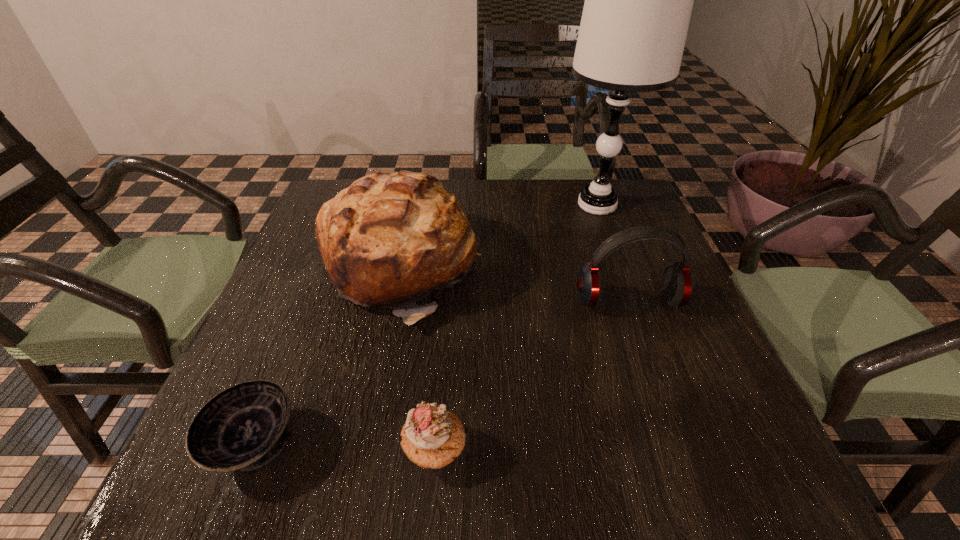
Image resolution: width=960 pixels, height=540 pixels. Find the location of `free space that is in between the bread and the tallest object`. free space that is in between the bread and the tallest object is located at coordinates (498, 236).

What are the coordinates of `vacant point located between the shortest object and the earphone` in the screenshot? It's located at (442, 372).

You are a GUI agent. You are given a task and a screenshot of the screen. Output one action in this format:
    pyautogui.click(x=<x>, y=<y>)
    Task: Click on the free space between the bread and the third tallest object
    
    Given the screenshot: What is the action you would take?
    pyautogui.click(x=514, y=284)

The height and width of the screenshot is (540, 960). I want to click on unoccupied area between the bread and the earphone, so click(514, 284).

The height and width of the screenshot is (540, 960). I want to click on the fourth closest object to the second shortest object, so click(638, 2).

The image size is (960, 540). I want to click on the third closest object relative to the bread, so click(677, 282).

This screenshot has height=540, width=960. Identify the location of vacant space that satisfies the following two spatial constraints: 1. on the back side of the table lamp; 2. on the left side of the bowl. (349, 205).

I want to click on vacant region that satisfies the following two spatial constraints: 1. on the front side of the bowl; 2. on the right side of the cupcake, so click(252, 450).

Locate an element on the screen. The width and height of the screenshot is (960, 540). free region that satisfies the following two spatial constraints: 1. on the back side of the bread; 2. on the right side of the table lamp is located at coordinates (412, 205).

At what (x,y) coordinates should I click in order to perform the action: click on free region that satisfies the following two spatial constraints: 1. on the back side of the table lamp; 2. on the left side of the second shortest object. Please return your answer as a coordinate pair (x, y). This screenshot has width=960, height=540. Looking at the image, I should click on (454, 205).